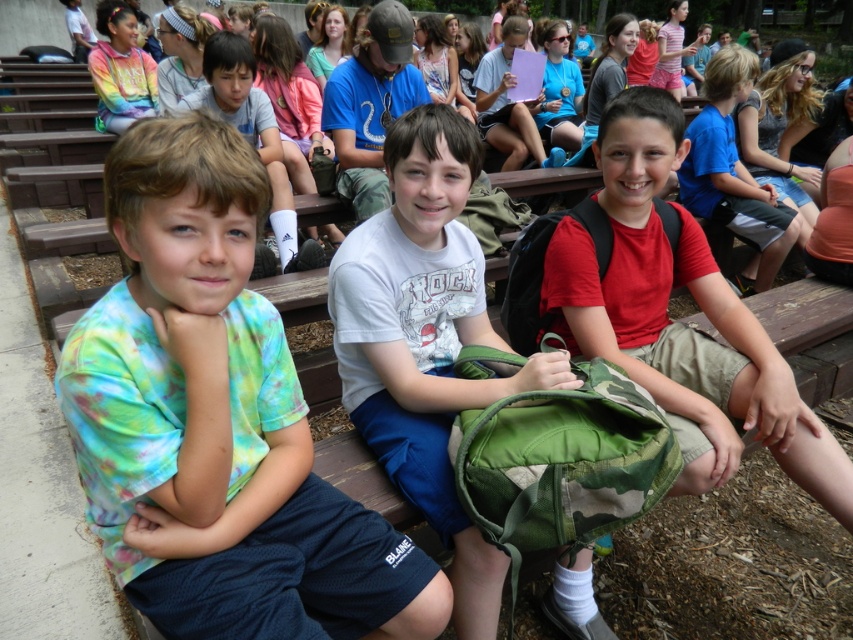
Is white cotton shirt at center to the right of tie-dye shirt at center from the viewer's perspective?

Correct, you'll find white cotton shirt at center to the right of tie-dye shirt at center.

Does point (350, 257) come in front of point (288, 272)?

Yes, point (350, 257) is in front of point (288, 272).

Is point (439, 132) closer to camera compared to point (286, 216)?

Yes.

Locate an element on the screen. This screenshot has width=853, height=640. white cotton shirt at center is located at coordinates (426, 340).

Who is more forward, (215, 134) or (318, 266)?

Point (215, 134)

Who is taller, tie-dye shirt at left or tie-dye shirt at center?

tie-dye shirt at center is taller.

Which is behind, point (294, 454) or point (280, 211)?

The point (280, 211) is behind.

Identify the location of tie-dye shirt at left. This screenshot has width=853, height=640. (218, 419).

Which of these two, white cotton shirt at center or camo fabric backpack at right, stands shorter?

camo fabric backpack at right is shorter.

Is point (491, 550) more distant than point (648, 330)?

No, (491, 550) is closer to viewer.

Locate an element on the screen. The image size is (853, 640). white cotton shirt at center is located at coordinates (426, 340).